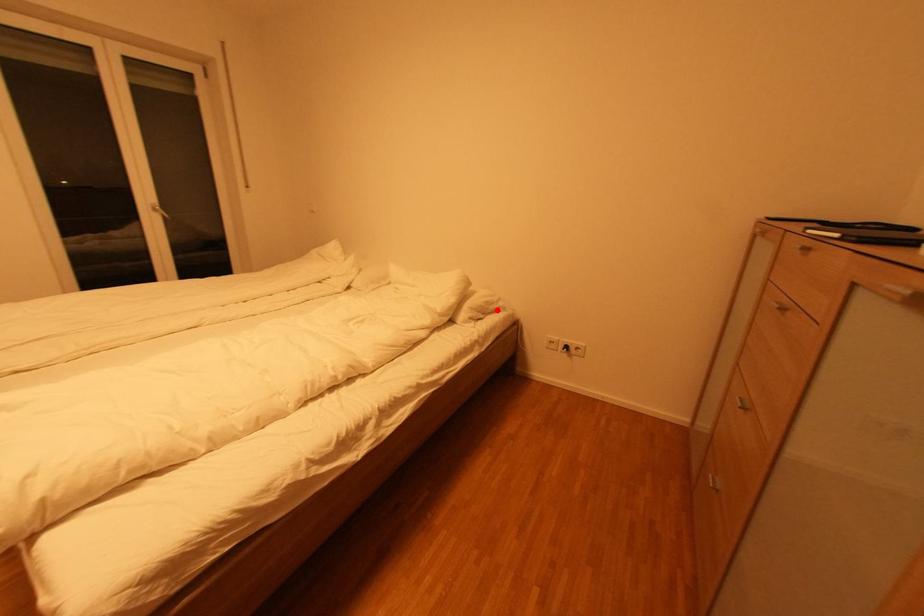
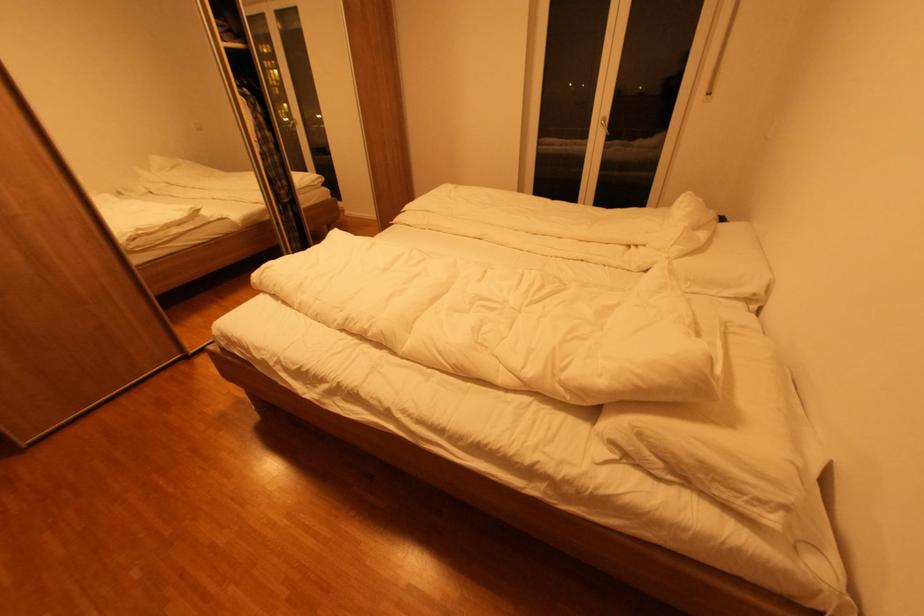
Question: I am providing you with two images of the same scene from different viewpoints. A red point is marked on the first image. Can you still see the location of the red point in image 2?

Choices:
 (A) Yes
 (B) No

Answer: (A)